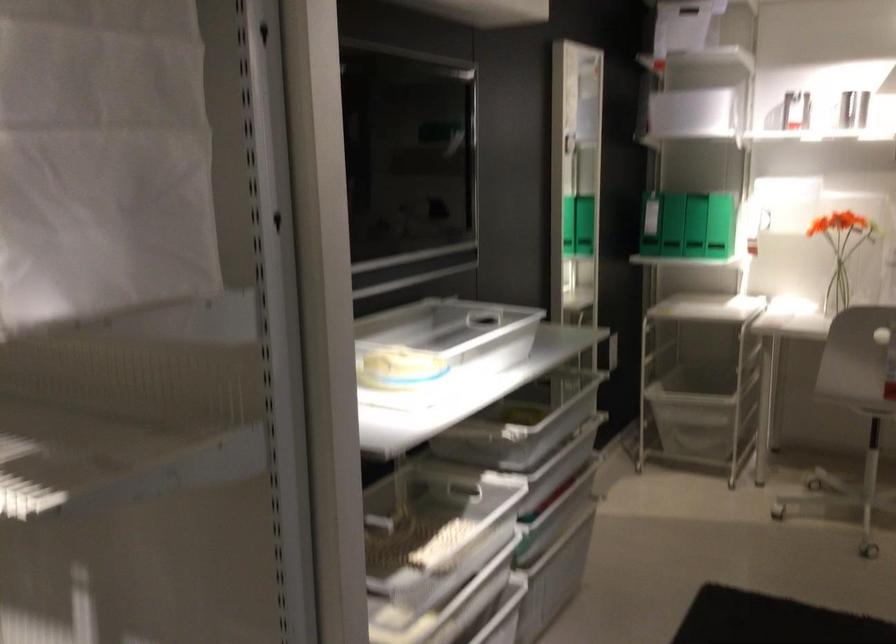
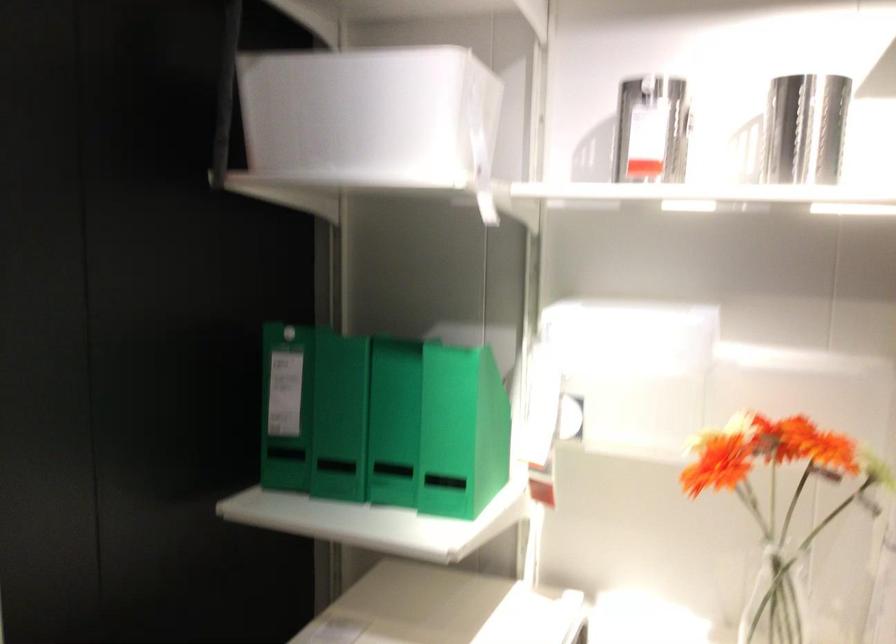
Find the pixel in the second image that matches point (728, 205) in the first image.

(392, 422)